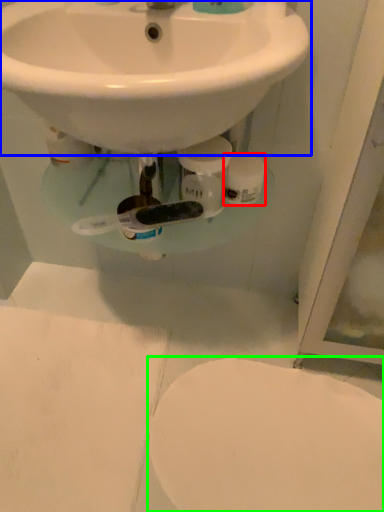
Question: Estimate the real-world distances between objects in this image. Which object is closer to toilet paper (highlighted by a red box), sink (highlighted by a blue box) or toilet (highlighted by a green box)?

Choices:
 (A) sink
 (B) toilet

Answer: (A)